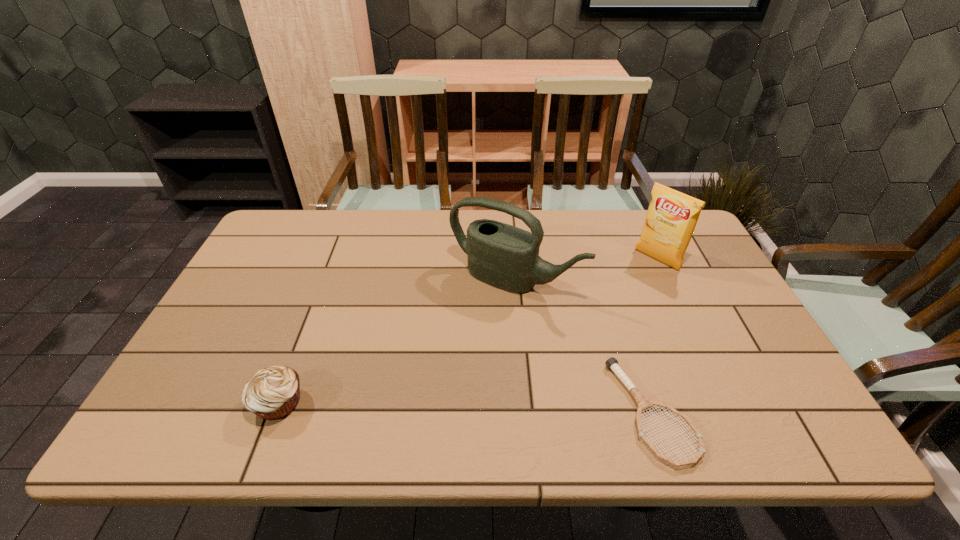
At what (x,y) coordinates should I click in order to perform the action: click on free spot on the desktop that is between the muffin and the shortest object and is positioned on the front of the rightmost object with the logo. Please return your answer as a coordinate pair (x, y). This screenshot has width=960, height=540. Looking at the image, I should click on (489, 408).

You are a GUI agent. You are given a task and a screenshot of the screen. Output one action in this format:
    pyautogui.click(x=<x>, y=<y>)
    Task: Click on the vacant space on the desktop that is between the leftmost object and the second object from right to left and is positioned on the spout of the watering can
    
    Given the screenshot: What is the action you would take?
    pyautogui.click(x=418, y=406)